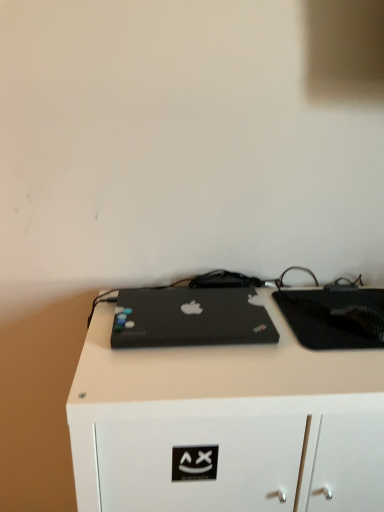
The width and height of the screenshot is (384, 512). Identify the location of free point above black matte laptop at center (from a real-world perspective). (187, 308).